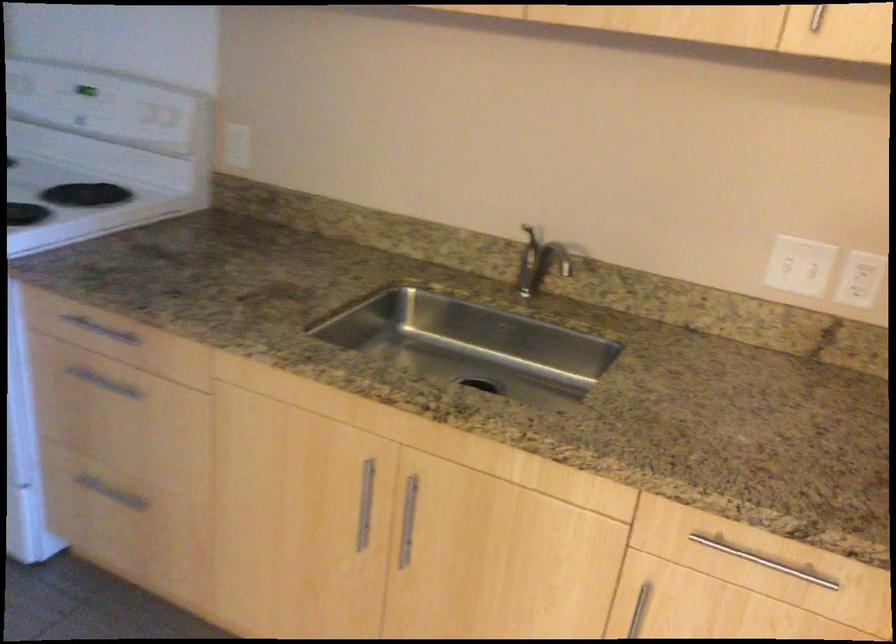
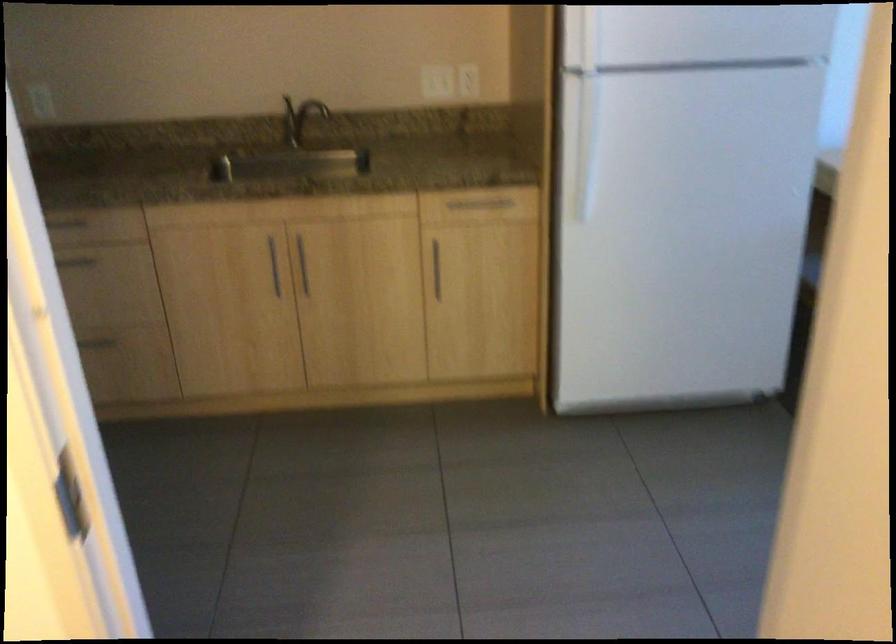
The point at (407,511) is marked in the first image. Where is the corresponding point in the second image?

(303, 265)